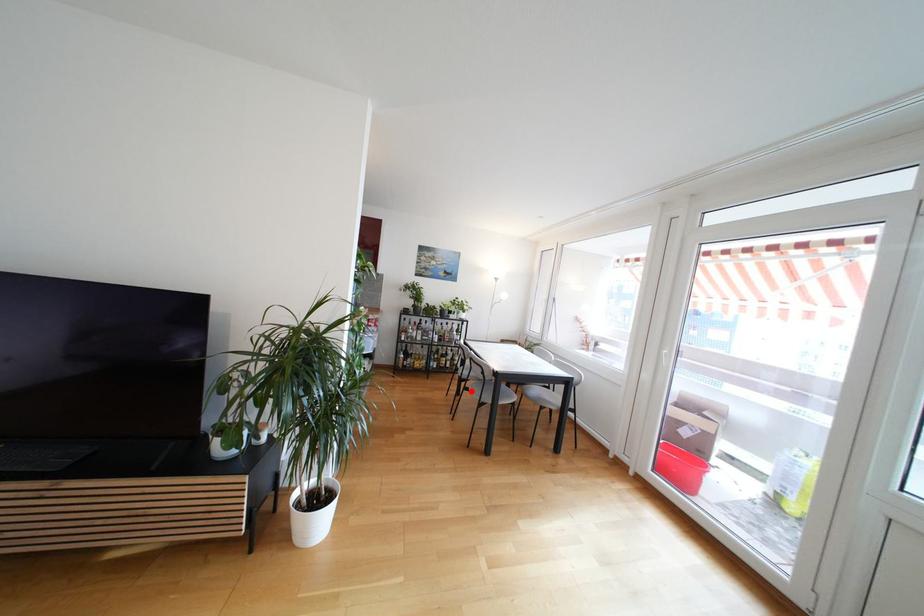
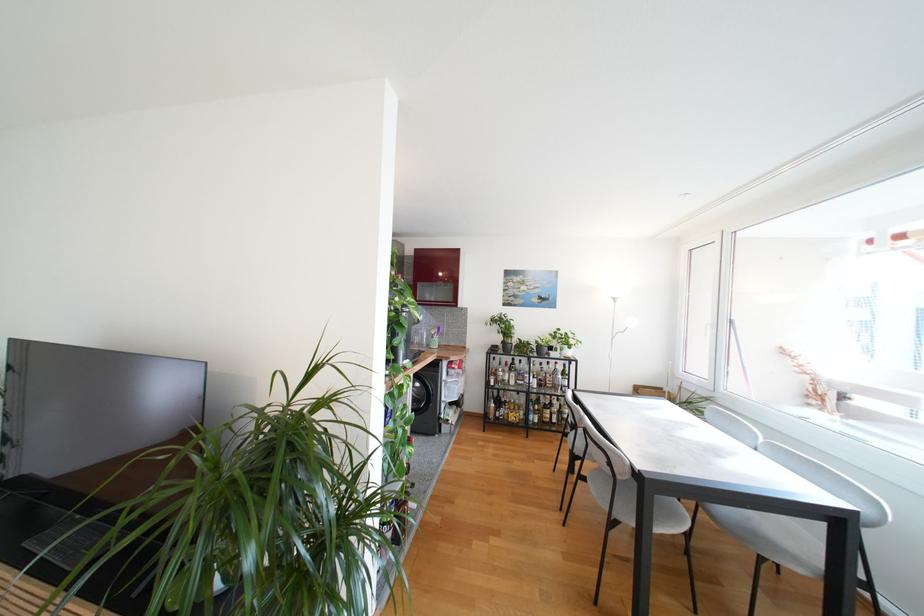
Question: A red point is marked in image1. In image2, is the corresponding 3D point closer to the camera or farther? Reply with the corresponding letter.

Choices:
 (A) The corresponding 3D point is closer.
 (B) The corresponding 3D point is farther.

Answer: (A)